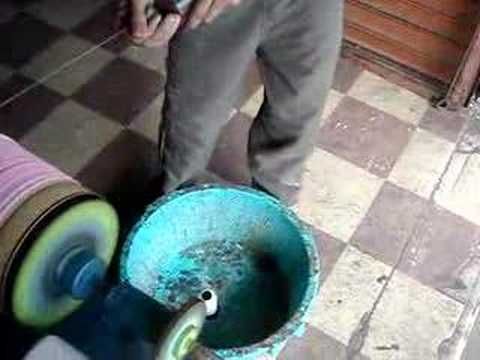
At what (x,y) coordinates should I click in order to perform the action: click on blue bucket. Please return your answer as a coordinate pair (x, y). Looking at the image, I should click on click(x=256, y=286).